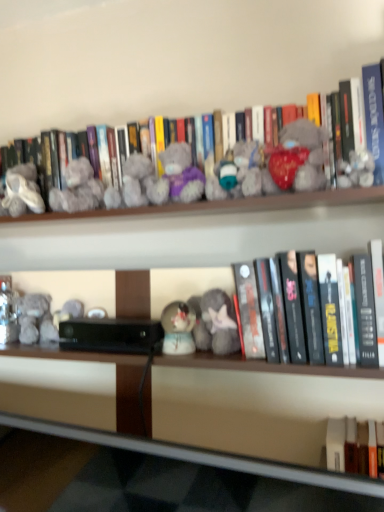
Measure the distance between point (72, 179) and camera.

Point (72, 179) and camera are 1.01 meters apart from each other.

Locate an element on the screen. This screenshot has height=512, width=384. black matte book at center, the 2th book positioned from the top is located at coordinates (360, 314).

What do you see at coordinates (23, 189) in the screenshot?
I see `white fabric ballet shoes at left, positioned as the seventh toy in right-to-left order` at bounding box center [23, 189].

The image size is (384, 512). What are the coordinates of `matte purple plush at center, the 5th toy in the left-to-right sequence` in the screenshot? It's located at (241, 174).

The image size is (384, 512). Describe the element at coordinates (285, 153) in the screenshot. I see `fluffy gray teddy bear at center, the 2th book in the bottom-to-top sequence` at that location.

Locate an element on the screen. Image resolution: width=384 pixels, height=512 pixels. gray plush bear at upper left, which ranks as the sixth toy in right-to-left order is located at coordinates click(x=78, y=189).

Considering the positions of objects matte purple plush at center, the 5th toy in the left-to-right sequence, and gray plush bear at upper left, which is the second toy from left to right, in the image provided, who is behind, matte purple plush at center, the 5th toy in the left-to-right sequence, or gray plush bear at upper left, which is the second toy from left to right,?

Positioned behind is gray plush bear at upper left, which is the second toy from left to right.

Which object is wider, matte purple plush at center, the 5th toy in the left-to-right sequence, or gray plush bear at upper left, which ranks as the sixth toy in right-to-left order?

Wider between the two is gray plush bear at upper left, which ranks as the sixth toy in right-to-left order.

Is matte purple plush at center, which is the 3th toy in right-to-left order, positioned far away from gray plush bear at upper left, which is the second toy from left to right?

No, matte purple plush at center, which is the 3th toy in right-to-left order, is not far away from gray plush bear at upper left, which is the second toy from left to right.

Locate an element on the screen. the 2nd toy behind the matte purple plush at center, the 5th toy in the left-to-right sequence is located at coordinates (217, 323).

Is matte purple plush at center, which is the 3th toy in right-to-left order, positioned with its back to fluffy gray plush at center, which appears as the fourth toy when viewed from the right?

No, matte purple plush at center, which is the 3th toy in right-to-left order, is not facing the opposite direction of fluffy gray plush at center, which appears as the fourth toy when viewed from the right.

Does matte purple plush at center, which is the 3th toy in right-to-left order, contain fluffy gray plush at center, which ranks as the fourth toy in left-to-right order?

Definitely not — fluffy gray plush at center, which ranks as the fourth toy in left-to-right order, is not inside matte purple plush at center, which is the 3th toy in right-to-left order.

Considering the relative positions of matte purple plush at center, which is the 3th toy in right-to-left order, and fluffy gray plush at center, which ranks as the fourth toy in left-to-right order, in the image provided, is matte purple plush at center, which is the 3th toy in right-to-left order, behind fluffy gray plush at center, which ranks as the fourth toy in left-to-right order,?

That is False.

Looking at this image, from the image's perspective, is matte gray plush at upper center, which is the 1th toy from right to left, on top of gray plush bear at upper left, which is the second toy from left to right?

Incorrect, from the image's perspective, matte gray plush at upper center, which is the 1th toy from right to left, is lower than gray plush bear at upper left, which is the second toy from left to right.

Would you consider matte gray plush at upper center, which is the 1th toy from right to left, to be distant from gray plush bear at upper left, which is the second toy from left to right?

No, there isn't a large distance between matte gray plush at upper center, which is the 1th toy from right to left, and gray plush bear at upper left, which is the second toy from left to right.

Measure the distance between matte gray plush at upper center, positioned as the 7th toy in left-to-right order, and gray plush bear at upper left, which ranks as the sixth toy in right-to-left order.

matte gray plush at upper center, positioned as the 7th toy in left-to-right order, and gray plush bear at upper left, which ranks as the sixth toy in right-to-left order, are 21.95 inches apart.

Based on their positions, is matte gray plush at upper center, which is the 1th toy from right to left, located to the left or right of gray plush bear at upper left, which is the second toy from left to right?

matte gray plush at upper center, which is the 1th toy from right to left, is positioned on gray plush bear at upper left, which is the second toy from left to right,'s right side.

Which is nearer, (5, 206) or (319, 122)?

Clearly, point (5, 206) is more distant from the camera than point (319, 122).

Considering the relative sizes of white fabric ballet shoes at left, positioned as the seventh toy in right-to-left order, and fluffy gray teddy bear at center, the 2th book in the bottom-to-top sequence, in the image provided, is white fabric ballet shoes at left, positioned as the seventh toy in right-to-left order, shorter than fluffy gray teddy bear at center, the 2th book in the bottom-to-top sequence,?

Correct, white fabric ballet shoes at left, positioned as the seventh toy in right-to-left order, is not as tall as fluffy gray teddy bear at center, the 2th book in the bottom-to-top sequence.

Who is bigger, white fabric ballet shoes at left, the first toy viewed from the left, or fluffy gray teddy bear at center, which ranks as the 1th book in top-to-bottom order?

With larger size is fluffy gray teddy bear at center, which ranks as the 1th book in top-to-bottom order.

Is white fabric ballet shoes at left, positioned as the seventh toy in right-to-left order, oriented away from fluffy gray teddy bear at center, which ranks as the 1th book in top-to-bottom order?

That's right, white fabric ballet shoes at left, positioned as the seventh toy in right-to-left order, is facing away from fluffy gray teddy bear at center, which ranks as the 1th book in top-to-bottom order.

From a real-world perspective, count 6th toys downward from the fluffy gray teddy bear at center, the 2th book in the bottom-to-top sequence, and point to it. Please provide its 2D coordinates.

[(356, 170)]

Who is smaller, matte gray plush at upper center, positioned as the 7th toy in left-to-right order, or fluffy gray teddy bear at center, which ranks as the 1th book in top-to-bottom order?

With smaller size is matte gray plush at upper center, positioned as the 7th toy in left-to-right order.

Relative to fluffy gray teddy bear at center, the 2th book in the bottom-to-top sequence, is matte gray plush at upper center, positioned as the 7th toy in left-to-right order, in front or behind?

matte gray plush at upper center, positioned as the 7th toy in left-to-right order, is in front of fluffy gray teddy bear at center, the 2th book in the bottom-to-top sequence.

Is matte gray plush at upper center, positioned as the 7th toy in left-to-right order, taller than fluffy gray teddy bear at center, which ranks as the 1th book in top-to-bottom order?

In fact, matte gray plush at upper center, positioned as the 7th toy in left-to-right order, may be shorter than fluffy gray teddy bear at center, which ranks as the 1th book in top-to-bottom order.

From the picture: How distant is gray plush bear at upper left, which ranks as the sixth toy in right-to-left order, from matte gray plush at upper center, positioned as the 7th toy in left-to-right order?

A distance of 55.75 centimeters exists between gray plush bear at upper left, which ranks as the sixth toy in right-to-left order, and matte gray plush at upper center, positioned as the 7th toy in left-to-right order.

Is matte gray plush at upper center, which is the 1th toy from right to left, inside gray plush bear at upper left, which ranks as the sixth toy in right-to-left order?

No, matte gray plush at upper center, which is the 1th toy from right to left, is not a part of gray plush bear at upper left, which ranks as the sixth toy in right-to-left order.

Looking at the image, does gray plush bear at upper left, which is the second toy from left to right, seem bigger or smaller compared to matte gray plush at upper center, which is the 1th toy from right to left?

gray plush bear at upper left, which is the second toy from left to right, is bigger than matte gray plush at upper center, which is the 1th toy from right to left.

From a real-world perspective, between gray plush bear at upper left, which is the second toy from left to right, and matte gray plush at upper center, which is the 1th toy from right to left, who is vertically higher?

From a 3D spatial view, gray plush bear at upper left, which is the second toy from left to right, is above.

Is there a large distance between white fabric ballet shoes at left, positioned as the seventh toy in right-to-left order, and black matte book at center, the 2th book positioned from the top?

That's not correct — white fabric ballet shoes at left, positioned as the seventh toy in right-to-left order, is a little close to black matte book at center, the 2th book positioned from the top.

Does white fabric ballet shoes at left, positioned as the seventh toy in right-to-left order, have a greater height compared to black matte book at center, which appears as the 1th book when ordered from the bottom?

Incorrect, the height of white fabric ballet shoes at left, positioned as the seventh toy in right-to-left order, is not larger of that of black matte book at center, which appears as the 1th book when ordered from the bottom.

Would you say white fabric ballet shoes at left, positioned as the seventh toy in right-to-left order, is outside black matte book at center, the 2th book positioned from the top?

Indeed, white fabric ballet shoes at left, positioned as the seventh toy in right-to-left order, is completely outside black matte book at center, the 2th book positioned from the top.

The height and width of the screenshot is (512, 384). I want to click on toy that is the 1st one above the matte purple plush at center, which is the 3th toy in right-to-left order (from a real-world perspective), so click(78, 189).

From a real-world perspective, which toy is the 3rd one underneath the matte purple plush at center, which is the 3th toy in right-to-left order? Please provide its 2D coordinates.

[(217, 323)]

When comparing their distances from matte gray plush at upper center, positioned as the 7th toy in left-to-right order, does fuzzy fabric teddy bear at center, the 5th toy viewed from the right, or black matte book at center, which appears as the 1th book when ordered from the bottom, seem further?

fuzzy fabric teddy bear at center, the 5th toy viewed from the right, is positioned further to the anchor matte gray plush at upper center, positioned as the 7th toy in left-to-right order.

Considering their positions, is fluffy gray teddy bear at center, which ranks as the 1th book in top-to-bottom order, positioned further to matte purple plush at center, which is the 3th toy in right-to-left order, than black matte book at center, the 2th book positioned from the top?

black matte book at center, the 2th book positioned from the top, is further to matte purple plush at center, which is the 3th toy in right-to-left order.

From the image, which object appears to be nearer to fluffy gray plush at center, which ranks as the fourth toy in left-to-right order, matte purple plush at center, which is the 3th toy in right-to-left order, or matte gray plush at upper center, which is the 1th toy from right to left?

The object closer to fluffy gray plush at center, which ranks as the fourth toy in left-to-right order, is matte purple plush at center, which is the 3th toy in right-to-left order.

Which object lies nearer to the anchor point white fabric ballet shoes at left, positioned as the seventh toy in right-to-left order, fuzzy fabric teddy bear at center, the 5th toy viewed from the right, or gray plush bear at upper left, which ranks as the sixth toy in right-to-left order?

gray plush bear at upper left, which ranks as the sixth toy in right-to-left order, lies closer to white fabric ballet shoes at left, positioned as the seventh toy in right-to-left order, than the other object.

Considering their positions, is matte purple plush at center, the 5th toy in the left-to-right sequence, positioned closer to gray plush bear at upper left, which is the second toy from left to right, than matte gray plush at upper center, positioned as the 7th toy in left-to-right order?

Among the two, matte purple plush at center, the 5th toy in the left-to-right sequence, is located nearer to gray plush bear at upper left, which is the second toy from left to right.

Based on their spatial positions, is black matte book at center, which appears as the 1th book when ordered from the bottom, or matte purple plush at center, the 5th toy in the left-to-right sequence, closer to wooden at lower center?

The object closer to wooden at lower center is black matte book at center, which appears as the 1th book when ordered from the bottom.

When comparing their distances from gray plush bear at upper left, which ranks as the sixth toy in right-to-left order, does white fabric ballet shoes at left, positioned as the seventh toy in right-to-left order, or black matte book at center, the 2th book positioned from the top, seem closer?

white fabric ballet shoes at left, positioned as the seventh toy in right-to-left order, is positioned closer to the anchor gray plush bear at upper left, which ranks as the sixth toy in right-to-left order.

Looking at the image, which one is located further to matte purple plush at center, the 5th toy in the left-to-right sequence, wooden at lower center or fluffy gray plush at center, which ranks as the fourth toy in left-to-right order?

Among the two, wooden at lower center is located further to matte purple plush at center, the 5th toy in the left-to-right sequence.

You are a GUI agent. You are given a task and a screenshot of the screen. Output one action in this format:
    pyautogui.click(x=<x>, y=<y>)
    Task: Click on the book that lies between fluffy gray teddy bear at center, the 2th book in the bottom-to-top sequence, and wooden at lower center from top to bottom
    This screenshot has width=384, height=512.
    Given the screenshot: What is the action you would take?
    pyautogui.click(x=360, y=314)

I want to click on book between white fabric ballet shoes at left, the first toy viewed from the left, and matte purple plush at center, the 5th toy in the left-to-right sequence, from left to right, so click(x=285, y=153).

Where is `book between fluffy gray teddy bear at center, the 2th book in the bottom-to-top sequence, and matte gray plush at upper center, positioned as the 7th toy in left-to-right order, from left to right`? book between fluffy gray teddy bear at center, the 2th book in the bottom-to-top sequence, and matte gray plush at upper center, positioned as the 7th toy in left-to-right order, from left to right is located at coordinates (360, 314).

Identify the location of book between fuzzy fabric teddy bear at center, the 5th toy viewed from the right, and wooden at lower center from top to bottom. Image resolution: width=384 pixels, height=512 pixels. (360, 314).